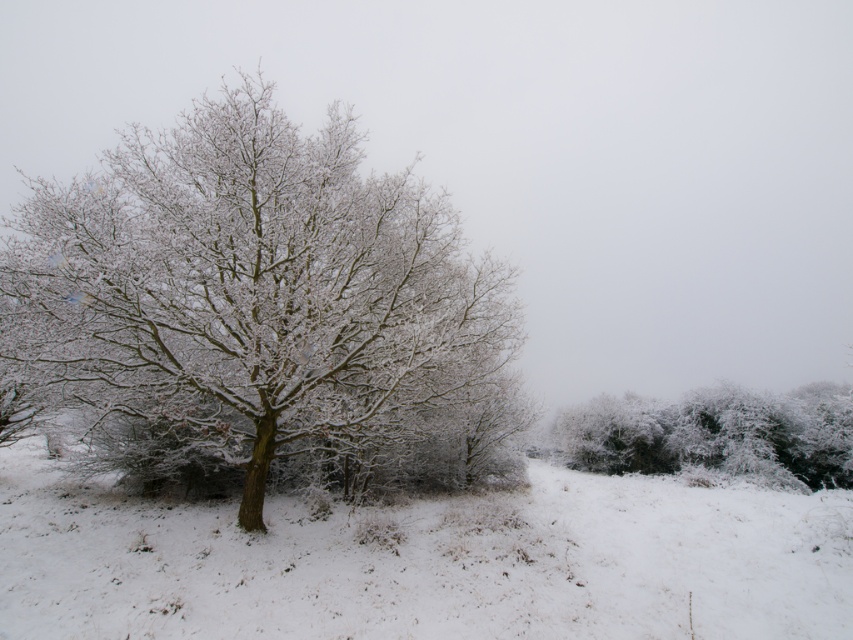
You are standing in the winter landscape and see two points marked in the image. The first point is at coordinates point (401, 406) and the second is at point (722, 412). Which of these points is closer to you?

Point (401, 406) is in front of point (722, 412), so it is closer to you.

You are standing in the winter landscape and see two points marked on the snow. The first point is labeled as point (436, 564) and the second is point (682, 428). Which point is closer to you?

Point (436, 564) is in front of point (682, 428), so it is closer to you.

You are an observer looking at the winter landscape. You notice the frosted bark tree at center and the white fluffy snow at center. Which object appears closer to you?

The frosted bark tree at center appears closer because the white fluffy snow at center is positioned behind it.